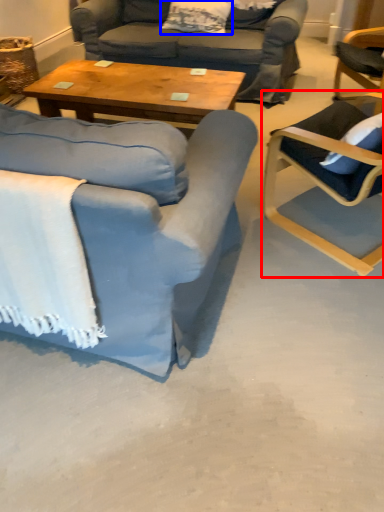
Question: Which object is closer to the camera taking this photo, chair (highlighted by a red box) or pillow (highlighted by a blue box)?

Choices:
 (A) chair
 (B) pillow

Answer: (A)